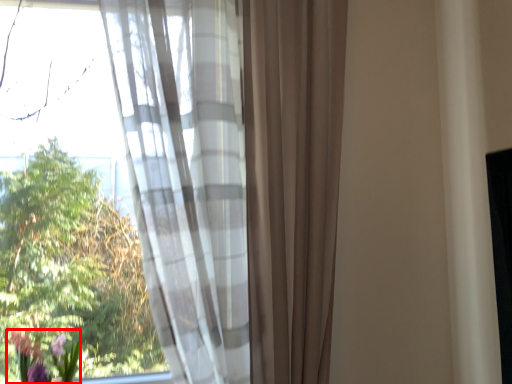
Question: Considering the relative positions of floral arrangement (annotated by the red box) and curtain in the image provided, where is floral arrangement (annotated by the red box) located with respect to the staircase?

Choices:
 (A) left
 (B) right

Answer: (A)